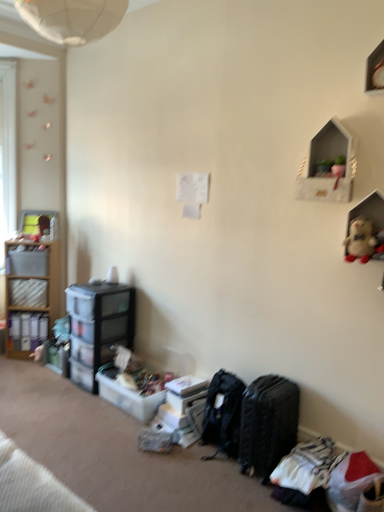
Question: Is plastic storage box at lower center, the third storage box positioned from the top, positioned far away from transparent plastic storage at lower left, the 2th shelf from the left?

Choices:
 (A) yes
 (B) no

Answer: (B)

Question: From the image's perspective, is plastic storage box at lower center, the 2th storage box when ordered from bottom to top, located beneath transparent plastic storage at lower left, the 2th shelf viewed from the front?

Choices:
 (A) no
 (B) yes

Answer: (B)

Question: From a real-world perspective, is plastic storage box at lower center, the third storage box positioned from the top, positioned over transparent plastic storage at lower left, the 2th shelf from the left, based on gravity?

Choices:
 (A) no
 (B) yes

Answer: (A)

Question: Does plastic storage box at lower center, which is the fourth storage box in left-to-right order, have a larger size compared to transparent plastic storage at lower left, the 2th shelf from the left?

Choices:
 (A) yes
 (B) no

Answer: (B)

Question: Is plastic storage box at lower center, which is the fourth storage box in left-to-right order, in front of transparent plastic storage at lower left, the 2th shelf from the left?

Choices:
 (A) yes
 (B) no

Answer: (A)

Question: Can you confirm if plastic storage box at lower center, which is the fourth storage box in left-to-right order, is positioned to the right of transparent plastic storage at lower left, the 2th shelf from the left?

Choices:
 (A) no
 (B) yes

Answer: (B)

Question: Does translucent plastic storage box at lower center, which is the first storage box in bottom-to-top order, have a greater height compared to matte plastic storage box at left, which is the second storage box in top-to-bottom order?

Choices:
 (A) no
 (B) yes

Answer: (A)

Question: From the image's perspective, is translucent plastic storage box at lower center, the fourth storage box in the top-to-bottom sequence, over matte plastic storage box at left, arranged as the first storage box when viewed from the left?

Choices:
 (A) no
 (B) yes

Answer: (A)

Question: From a real-world perspective, is translucent plastic storage box at lower center, which is the 2th storage box in right-to-left order, under matte plastic storage box at left, marked as the third storage box in a bottom-to-top arrangement?

Choices:
 (A) no
 (B) yes

Answer: (B)

Question: Are translucent plastic storage box at lower center, which is the first storage box in bottom-to-top order, and matte plastic storage box at left, marked as the third storage box in a bottom-to-top arrangement, located far from each other?

Choices:
 (A) no
 (B) yes

Answer: (B)

Question: Is translucent plastic storage box at lower center, which is the 2th storage box in right-to-left order, smaller than matte plastic storage box at left, marked as the third storage box in a bottom-to-top arrangement?

Choices:
 (A) no
 (B) yes

Answer: (A)

Question: Is translucent plastic storage box at lower center, which is the 3th storage box from left to right, shorter than matte plastic storage box at left, marked as the third storage box in a bottom-to-top arrangement?

Choices:
 (A) yes
 (B) no

Answer: (A)

Question: From the image's perspective, is matte plastic shelves at left, which appears as the 1th shelf when viewed from the back, over white matte shelf at upper right, the third shelf in the back-to-front sequence?

Choices:
 (A) no
 (B) yes

Answer: (A)